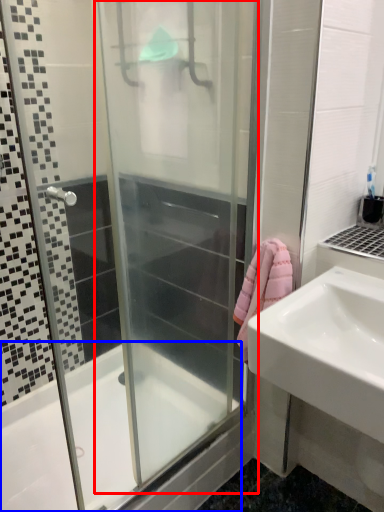
Question: Which of the following is the closest to the observer, screen door (highlighted by a red box) or bathtub (highlighted by a blue box)?

Choices:
 (A) screen door
 (B) bathtub

Answer: (A)